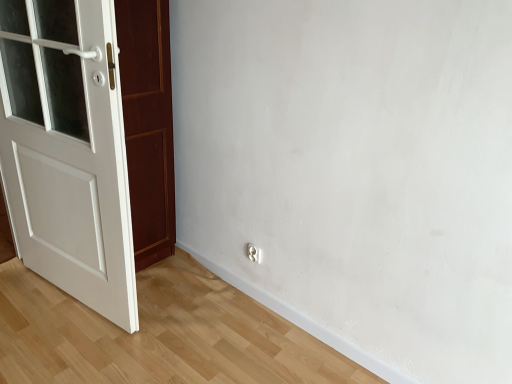
What is the approximate height of white painted wood door at left?

white painted wood door at left is 4.38 feet tall.

What do you see at coordinates (67, 150) in the screenshot? I see `white painted wood door at left` at bounding box center [67, 150].

This screenshot has height=384, width=512. Find the location of `white painted wood door at left`. white painted wood door at left is located at coordinates (67, 150).

Describe the element at coordinates (254, 253) in the screenshot. I see `white glossy electric outlet at lower center` at that location.

The image size is (512, 384). Find the location of `white glossy electric outlet at lower center`. white glossy electric outlet at lower center is located at coordinates (254, 253).

Measure the distance between white glossy electric outlet at lower center and camera.

They are 2.02 meters apart.

At what (x,y) coordinates should I click in order to perform the action: click on white painted wood door at left. Please return your answer as a coordinate pair (x, y). Looking at the image, I should click on (67, 150).

Considering the positions of objects white glossy electric outlet at lower center and white painted wood door at left in the image provided, who is more to the left, white glossy electric outlet at lower center or white painted wood door at left?

white painted wood door at left.

Between white glossy electric outlet at lower center and white painted wood door at left, which one is positioned behind?

white glossy electric outlet at lower center is further from the camera.

Considering the points (250, 255) and (104, 99), which point is behind, point (250, 255) or point (104, 99)?

Positioned behind is point (250, 255).

From the image's perspective, would you say white glossy electric outlet at lower center is positioned over white painted wood door at left?

Actually, white glossy electric outlet at lower center appears below white painted wood door at left in the image.

From a real-world perspective, which object rests below the other?

white glossy electric outlet at lower center, from a real-world perspective.

Which object is thinner, white glossy electric outlet at lower center or white painted wood door at left?

white glossy electric outlet at lower center.

Consider the image. Which of these two, white glossy electric outlet at lower center or white painted wood door at left, stands shorter?

white glossy electric outlet at lower center.

Considering the relative sizes of white glossy electric outlet at lower center and white painted wood door at left in the image provided, is white glossy electric outlet at lower center smaller than white painted wood door at left?

Yes.

Is white glossy electric outlet at lower center spatially inside white painted wood door at left, or outside of it?

white glossy electric outlet at lower center is located beyond the bounds of white painted wood door at left.

Would you consider white glossy electric outlet at lower center to be distant from white painted wood door at left?

They are positioned close to each other.

Is white glossy electric outlet at lower center turned away from white painted wood door at left?

That's not correct — white glossy electric outlet at lower center is not looking away from white painted wood door at left.

How many degrees apart are the facing directions of white glossy electric outlet at lower center and white painted wood door at left?

6.45 degrees separate the facing orientations of white glossy electric outlet at lower center and white painted wood door at left.

Could you measure the distance between white glossy electric outlet at lower center and white painted wood door at left?

They are 38.41 inches apart.

Find the location of a particular element. This screenshot has width=512, height=384. electric outlet below the white painted wood door at left (from the image's perspective) is located at coordinates (254, 253).

Between white painted wood door at left and white glossy electric outlet at lower center, which one appears on the left side from the viewer's perspective?

white painted wood door at left.

Considering the positions of objects white painted wood door at left and white glossy electric outlet at lower center in the image provided, who is in front, white painted wood door at left or white glossy electric outlet at lower center?

white painted wood door at left is in front.

Does point (40, 262) come behind point (254, 258)?

Yes, point (40, 262) is farther from viewer.

From the picture: From the image's perspective, is white painted wood door at left beneath white glossy electric outlet at lower center?

Actually, white painted wood door at left appears above white glossy electric outlet at lower center in the image.

From a real-world perspective, is white painted wood door at left physically located above or below white glossy electric outlet at lower center?

From a real-world perspective, white painted wood door at left is physically above white glossy electric outlet at lower center.

Is white painted wood door at left thinner than white glossy electric outlet at lower center?

No.

From their relative heights in the image, would you say white painted wood door at left is taller or shorter than white glossy electric outlet at lower center?

In the image, white painted wood door at left appears to be taller than white glossy electric outlet at lower center.

Who is bigger, white painted wood door at left or white glossy electric outlet at lower center?

Bigger between the two is white painted wood door at left.

Is white glossy electric outlet at lower center a part of white painted wood door at left?

That's incorrect, white glossy electric outlet at lower center is not inside white painted wood door at left.

Based on the photo, is there a large distance between white painted wood door at left and white glossy electric outlet at lower center?

No, white painted wood door at left is in close proximity to white glossy electric outlet at lower center.

Is white painted wood door at left looking in the opposite direction of white glossy electric outlet at lower center?

No, white painted wood door at left's orientation is not away from white glossy electric outlet at lower center.

What's the angular difference between white painted wood door at left and white glossy electric outlet at lower center's facing directions?

The facing directions of white painted wood door at left and white glossy electric outlet at lower center are 6.45 degrees apart.

Measure the distance between white painted wood door at left and white glossy electric outlet at lower center.

38.41 inches.

You are a GUI agent. You are given a task and a screenshot of the screen. Output one action in this format:
    pyautogui.click(x=<x>, y=<y>)
    Task: Click on the door located on the left of white glossy electric outlet at lower center
    The width and height of the screenshot is (512, 384).
    Given the screenshot: What is the action you would take?
    pyautogui.click(x=67, y=150)

This screenshot has width=512, height=384. I want to click on door on the left side of white glossy electric outlet at lower center, so click(67, 150).

The width and height of the screenshot is (512, 384). What are the coordinates of `electric outlet lying behind the white painted wood door at left` in the screenshot? It's located at (254, 253).